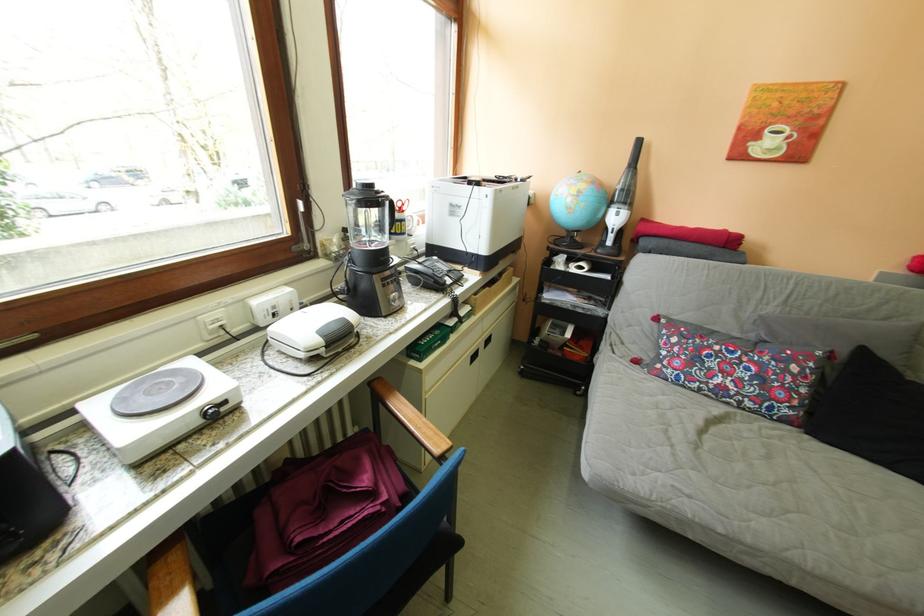
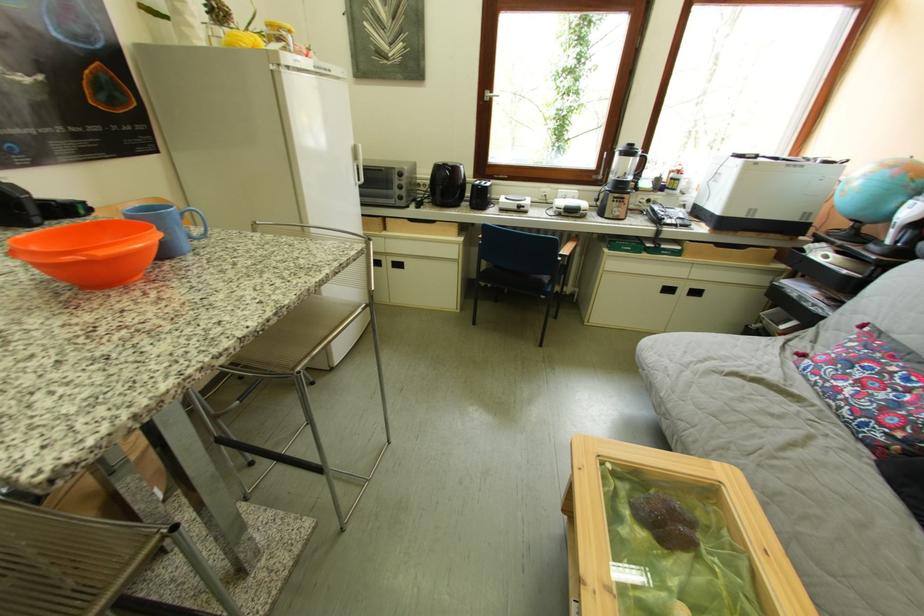
Where in the second image is the point corresponding to [591,195] from the first image?

(877, 177)